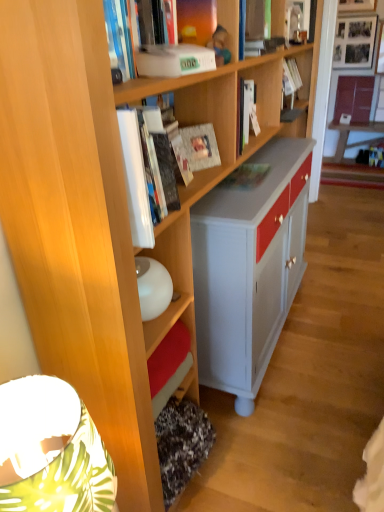
Question: Is matte green book at center, the third book positioned from the front, situated inside white glossy book at upper center, arranged as the 5th book when viewed from the back, or outside?

Choices:
 (A) outside
 (B) inside

Answer: (A)

Question: From a real-world perspective, relative to white glossy book at upper center, the 1th book positioned from the front, is matte green book at center, arranged as the 5th book when viewed from the top, vertically above or below?

Choices:
 (A) above
 (B) below

Answer: (B)

Question: Which object is the closest to the white glossy cabinet at upper right?

Choices:
 (A) matte brown book at upper right, placed as the 5th book when sorted from left to right
 (B) matte green book at center, the 3th book viewed from the back
 (C) white glossy book at upper center, arranged as the 5th book when viewed from the back
 (D) matte paper at center, the second paperback book positioned from the front
 (E) white glossy desk at upper right

Answer: (A)

Question: Which object is positioned closest to the matte brown book at upper right, placed as the 5th book when sorted from left to right?

Choices:
 (A) matte paper at center, the second paperback book positioned from the front
 (B) white matte book at upper center, the 4th book in the back-to-front sequence
 (C) white matte paperback book at upper center, the 2th paperback book viewed from the back
 (D) hardcover book at upper center, the 4th book from the left
 (E) matte green book at center, the 3th book viewed from the back

Answer: (D)